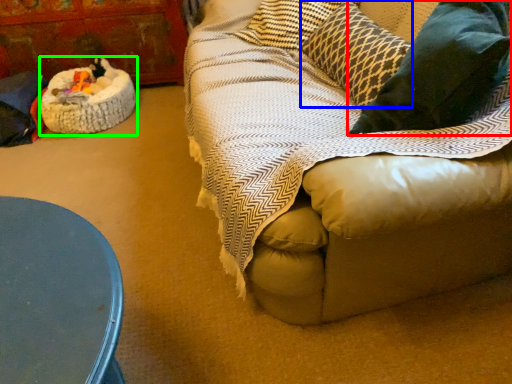
Question: Estimate the real-world distances between objects in this image. Which object is closer to throw pillow (highlighted by a red box), pillow (highlighted by a blue box) or cat bed (highlighted by a green box)?

Choices:
 (A) pillow
 (B) cat bed

Answer: (A)